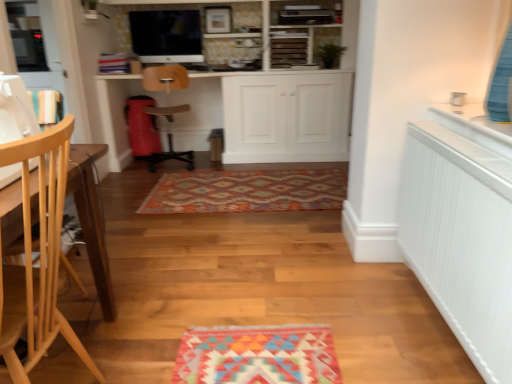
Question: Considering the relative positions of satin black monitor at upper center and wooden at center, placed as the 1th chair when sorted from back to front, in the image provided, is satin black monitor at upper center behind wooden at center, placed as the 1th chair when sorted from back to front,?

Choices:
 (A) no
 (B) yes

Answer: (B)

Question: Considering the relative sizes of satin black monitor at upper center and wooden at center, the second chair in the bottom-to-top sequence, in the image provided, is satin black monitor at upper center bigger than wooden at center, the second chair in the bottom-to-top sequence,?

Choices:
 (A) yes
 (B) no

Answer: (B)

Question: Does satin black monitor at upper center have a smaller size compared to wooden at center, the 2th chair from the front?

Choices:
 (A) no
 (B) yes

Answer: (B)

Question: Considering the relative sizes of satin black monitor at upper center and wooden at center, placed as the 1th chair when sorted from back to front, in the image provided, is satin black monitor at upper center wider than wooden at center, placed as the 1th chair when sorted from back to front,?

Choices:
 (A) no
 (B) yes

Answer: (A)

Question: Does satin black monitor at upper center appear on the right side of wooden at center, placed as the 1th chair when sorted from back to front?

Choices:
 (A) yes
 (B) no

Answer: (B)

Question: Does satin black monitor at upper center have a lesser height compared to wooden at center, which is the first chair from top to bottom?

Choices:
 (A) no
 (B) yes

Answer: (B)

Question: Is white matte cabinet at center not inside wooden sewing machine at left?

Choices:
 (A) yes
 (B) no

Answer: (A)

Question: Is white matte cabinet at center not near wooden sewing machine at left?

Choices:
 (A) no
 (B) yes

Answer: (B)

Question: Is white matte cabinet at center behind wooden sewing machine at left?

Choices:
 (A) no
 (B) yes

Answer: (B)

Question: From a real-world perspective, is white matte cabinet at center positioned under wooden sewing machine at left based on gravity?

Choices:
 (A) yes
 (B) no

Answer: (A)

Question: Is white matte cabinet at center aimed at wooden sewing machine at left?

Choices:
 (A) no
 (B) yes

Answer: (B)

Question: Is white matte cabinet at center thinner than wooden sewing machine at left?

Choices:
 (A) yes
 (B) no

Answer: (B)

Question: From a real-world perspective, is white matte cabinet at center physically below light wood chair at left, which appears as the second chair when viewed from the top?

Choices:
 (A) no
 (B) yes

Answer: (B)